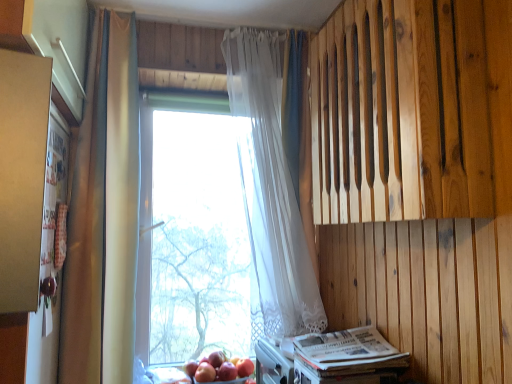
Question: Does white paper magazine at lower right appear on the right side of matte gold curtain at left, arranged as the second curtain when viewed from the right?

Choices:
 (A) yes
 (B) no

Answer: (A)

Question: Can you confirm if white paper magazine at lower right is positioned to the left of matte gold curtain at left, the first curtain when ordered from left to right?

Choices:
 (A) no
 (B) yes

Answer: (A)

Question: From a real-world perspective, is white paper magazine at lower right over matte gold curtain at left, the first curtain when ordered from left to right?

Choices:
 (A) no
 (B) yes

Answer: (A)

Question: Is white paper magazine at lower right positioned behind matte gold curtain at left, the first curtain when ordered from left to right?

Choices:
 (A) no
 (B) yes

Answer: (A)

Question: Is matte gold curtain at left, arranged as the second curtain when viewed from the right, a part of white paper magazine at lower right?

Choices:
 (A) yes
 (B) no

Answer: (B)

Question: Considering the positions of matte gold curtain at left, the first curtain when ordered from left to right, and white sheer curtain at center, the second curtain positioned from the left, in the image, is matte gold curtain at left, the first curtain when ordered from left to right, wider or thinner than white sheer curtain at center, the second curtain positioned from the left,?

Choices:
 (A) wide
 (B) thin

Answer: (B)

Question: Is matte gold curtain at left, the first curtain when ordered from left to right, taller or shorter than white sheer curtain at center, placed as the 1th curtain when sorted from right to left?

Choices:
 (A) tall
 (B) short

Answer: (A)

Question: From a real-world perspective, relative to white sheer curtain at center, placed as the 1th curtain when sorted from right to left, is matte gold curtain at left, the first curtain when ordered from left to right, vertically above or below?

Choices:
 (A) above
 (B) below

Answer: (B)

Question: From the image's perspective, is matte gold curtain at left, arranged as the second curtain when viewed from the right, positioned above or below white sheer curtain at center, placed as the 1th curtain when sorted from right to left?

Choices:
 (A) above
 (B) below

Answer: (B)

Question: Is matte gold curtain at left, the first curtain when ordered from left to right, bigger or smaller than glossy red apple at lower center, which ranks as the second apple in right-to-left order?

Choices:
 (A) small
 (B) big

Answer: (B)

Question: Visually, is matte gold curtain at left, the first curtain when ordered from left to right, positioned to the left or to the right of glossy red apple at lower center, which ranks as the second apple in right-to-left order?

Choices:
 (A) left
 (B) right

Answer: (A)

Question: Looking at their shapes, would you say matte gold curtain at left, the first curtain when ordered from left to right, is wider or thinner than glossy red apple at lower center, which ranks as the second apple in right-to-left order?

Choices:
 (A) thin
 (B) wide

Answer: (B)

Question: From the image's perspective, relative to glossy red apple at lower center, placed as the 2th apple when sorted from left to right, is matte gold curtain at left, the first curtain when ordered from left to right, above or below?

Choices:
 (A) below
 (B) above

Answer: (B)

Question: Do you think white sheer curtain at center, the second curtain positioned from the left, is within transparent glass window at center, or outside of it?

Choices:
 (A) inside
 (B) outside

Answer: (B)

Question: From their relative heights in the image, would you say white sheer curtain at center, placed as the 1th curtain when sorted from right to left, is taller or shorter than transparent glass window at center?

Choices:
 (A) tall
 (B) short

Answer: (B)